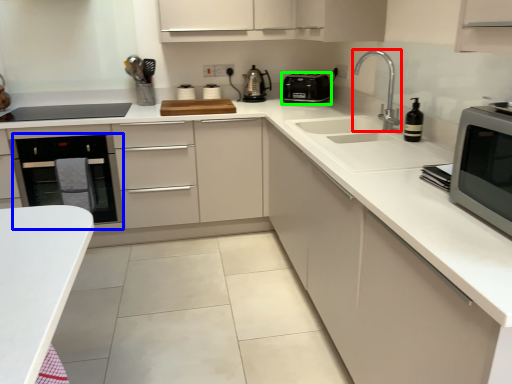
Question: Which object is positioned closest to tap (highlighted by a red box)? Select from oven (highlighted by a blue box) and kitchen appliance (highlighted by a green box).

Choices:
 (A) oven
 (B) kitchen appliance

Answer: (B)